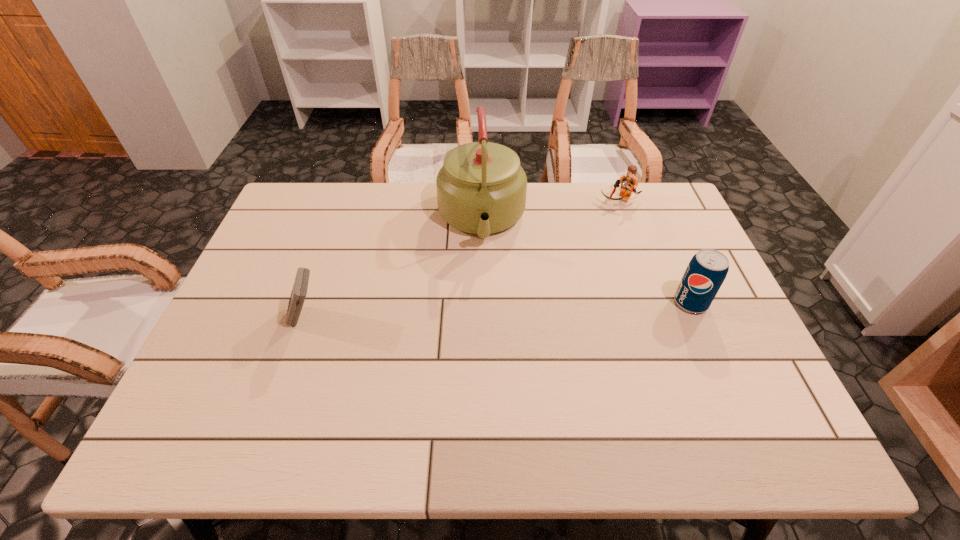
The width and height of the screenshot is (960, 540). Find the location of `object present at the far right corner`. object present at the far right corner is located at coordinates (629, 182).

Where is `vacant space at the near edge of the desktop`? vacant space at the near edge of the desktop is located at coordinates (655, 393).

Locate an element on the screen. The width and height of the screenshot is (960, 540). vacant space at the left edge of the desktop is located at coordinates (249, 284).

The width and height of the screenshot is (960, 540). What are the coordinates of `vacant space at the right edge of the desktop` in the screenshot? It's located at (730, 327).

Image resolution: width=960 pixels, height=540 pixels. In order to click on vacant space at the far left corner in this screenshot , I will do `click(331, 195)`.

The width and height of the screenshot is (960, 540). In order to click on vacant space at the near left corner of the desktop in this screenshot , I will do `click(243, 383)`.

Where is `free location at the far right corner of the desktop`? The image size is (960, 540). free location at the far right corner of the desktop is located at coordinates (636, 202).

In the image, there is a desktop. At what (x,y) coordinates should I click in order to perform the action: click on free space at the near right corner. Please return your answer as a coordinate pair (x, y). The width and height of the screenshot is (960, 540). Looking at the image, I should click on (743, 390).

The width and height of the screenshot is (960, 540). I want to click on vacant space that is in between the shortest object and the kettle, so [x=550, y=210].

Where is `blank region between the tallest object and the calculator`? blank region between the tallest object and the calculator is located at coordinates (394, 269).